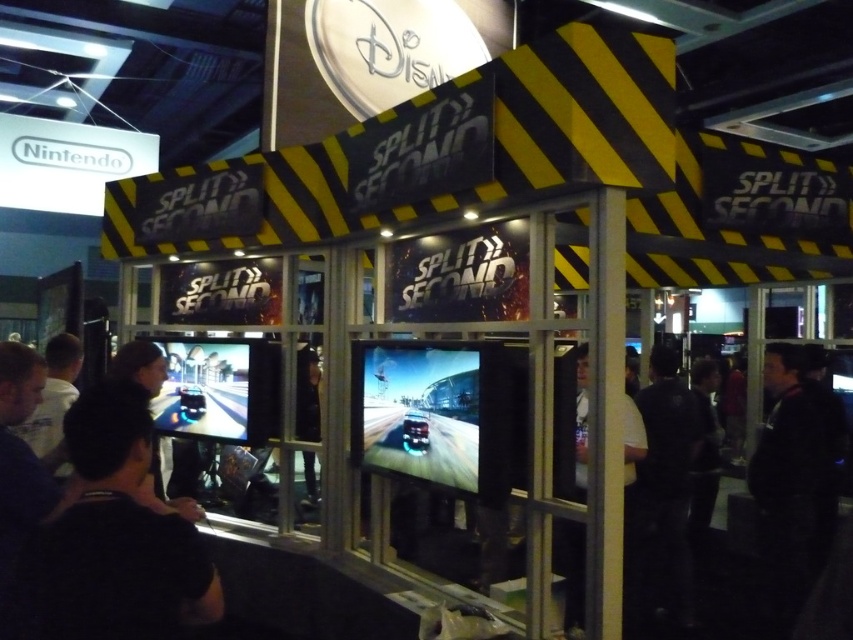
Question: Can you confirm if black matte shirt at lower left is thinner than black fabric at right?

Choices:
 (A) no
 (B) yes

Answer: (B)

Question: Can you confirm if black fabric jacket at right is smaller than black fabric at right?

Choices:
 (A) yes
 (B) no

Answer: (B)

Question: Does black fabric at right lie in front of dark hair at lower left?

Choices:
 (A) no
 (B) yes

Answer: (A)

Question: Among these objects, which one is farthest from the camera?

Choices:
 (A) black matte shirt at lower left
 (B) dark hair at lower left
 (C) black fabric at right
 (D) black fabric jacket at right

Answer: (D)

Question: Which object appears farthest from the camera in this image?

Choices:
 (A) black fabric jacket at right
 (B) black fabric at right

Answer: (A)

Question: Which point is closer to the camera?

Choices:
 (A) dark hair at lower left
 (B) black fabric at right

Answer: (A)